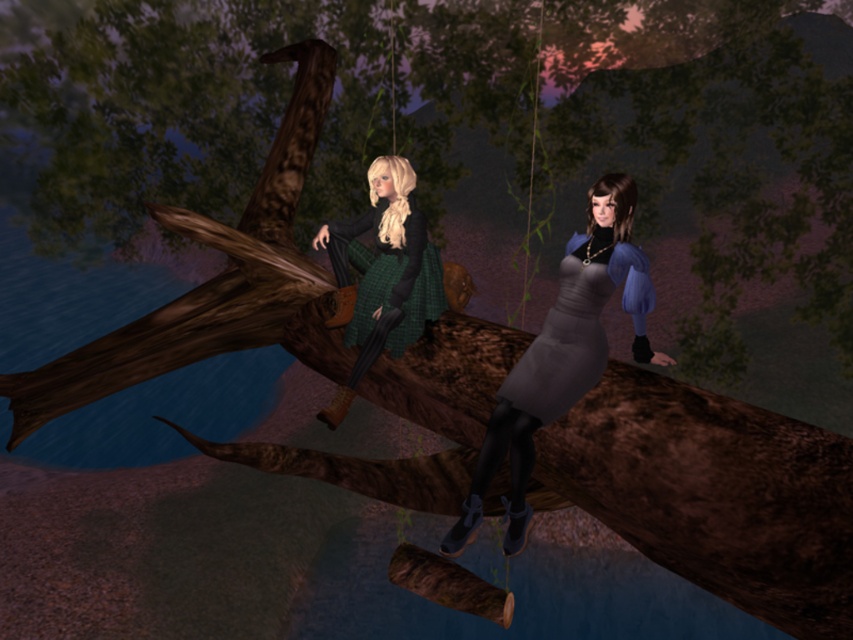
Does point (633, 300) come behind point (387, 291)?

No, (633, 300) is in front of (387, 291).

Locate an element on the screen. The width and height of the screenshot is (853, 640). matte gray dress at center is located at coordinates (561, 355).